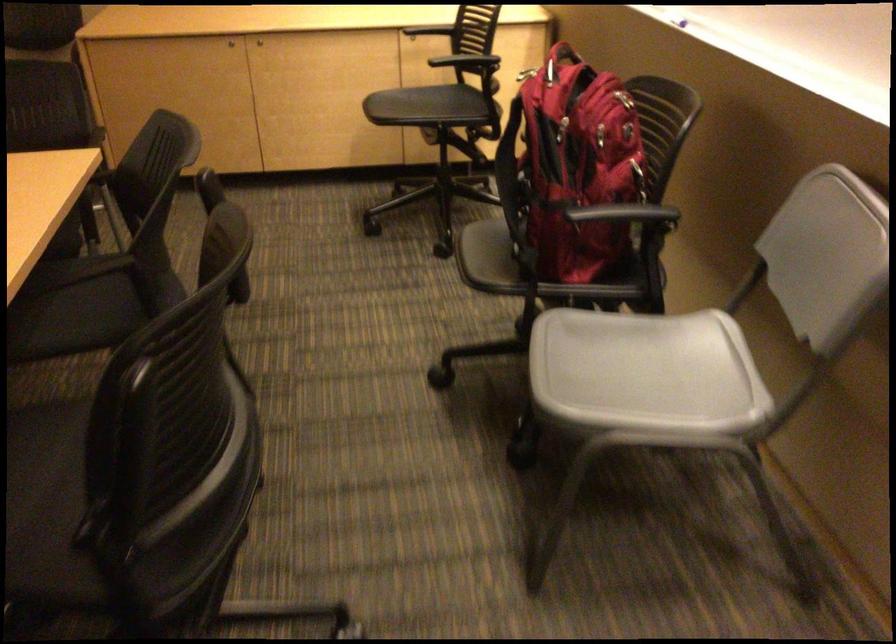
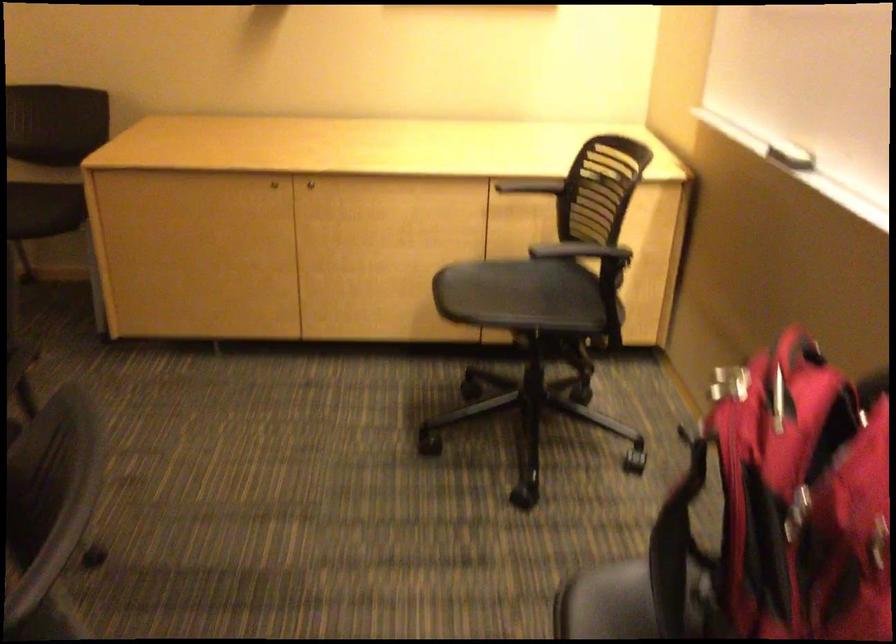
Question: In a continuous first-person perspective shot, in which direction is the camera moving?

Choices:
 (A) Left
 (B) Right
 (C) Forward
 (D) Backward

Answer: (C)